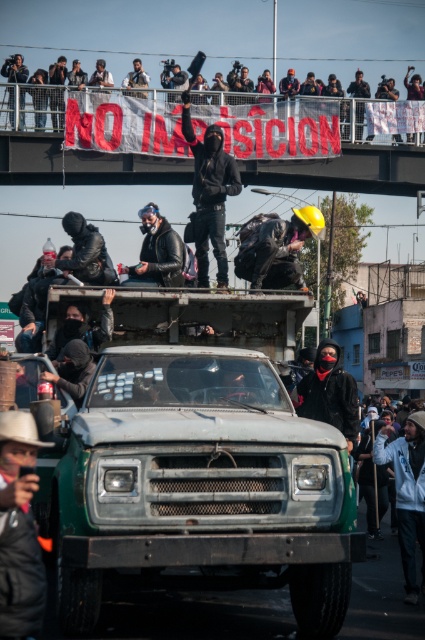
Is black matte jacket at center positioned before matte black camera at upper center?

Yes.

Is point (354, 397) positioned after point (136, 84)?

No, it is in front of (136, 84).

Find the location of a particular element. The width and height of the screenshot is (425, 640). black matte jacket at center is located at coordinates (329, 392).

Where is `black matte jacket at center`? The height and width of the screenshot is (640, 425). black matte jacket at center is located at coordinates (329, 392).

The height and width of the screenshot is (640, 425). Identify the location of white matte jacket at lower right. (407, 492).

Is white matte jacket at lower right above black leather jacket at upper center?

No, white matte jacket at lower right is not above black leather jacket at upper center.

Image resolution: width=425 pixels, height=640 pixels. Find the location of `white matte jacket at lower right`. white matte jacket at lower right is located at coordinates (407, 492).

At what (x,y) coordinates should I click in order to perform the action: click on brown leather hat at lower left. Please return your answer as a coordinate pair (x, y). The height and width of the screenshot is (640, 425). Looking at the image, I should click on (19, 529).

Who is more distant from viewer, (25, 616) or (212, 161)?

The point (212, 161) is behind.

Is point (25, 621) behind point (193, 216)?

No, (25, 621) is closer to viewer.

Where is `brown leather hat at lower left`? brown leather hat at lower left is located at coordinates (19, 529).